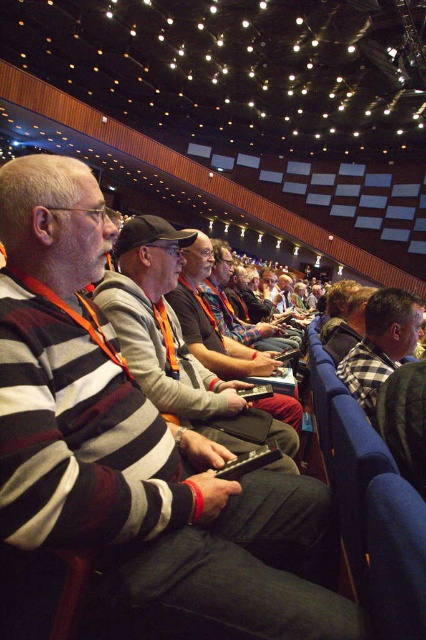
Does point (383, 360) come behind point (267, 342)?

That is False.

Can you confirm if checkered fabric shirt at right is positioned below striped sweater at center?

Correct, checkered fabric shirt at right is located below striped sweater at center.

Describe the element at coordinates (380, 342) in the screenshot. The image size is (426, 640). I see `checkered fabric shirt at right` at that location.

Find the location of a particular element. The image size is (426, 640). checkered fabric shirt at right is located at coordinates (380, 342).

Who is shorter, striped wool sweater at center or checkered fabric shirt at right?

checkered fabric shirt at right is shorter.

This screenshot has height=640, width=426. What do you see at coordinates (135, 452) in the screenshot?
I see `striped wool sweater at center` at bounding box center [135, 452].

Is point (264, 573) more distant than point (371, 323)?

No, (264, 573) is in front of (371, 323).

The height and width of the screenshot is (640, 426). What are the coordinates of `striped wool sweater at center` in the screenshot? It's located at (135, 452).

How much distance is there between striped wool sweater at center and striped sweater at center?

2.24 meters

Is striped wool sweater at center to the left of striped sweater at center from the viewer's perspective?

Indeed, striped wool sweater at center is positioned on the left side of striped sweater at center.

At what (x,y) coordinates should I click in order to perform the action: click on striped wool sweater at center. Please return your answer as a coordinate pair (x, y). Looking at the image, I should click on (135, 452).